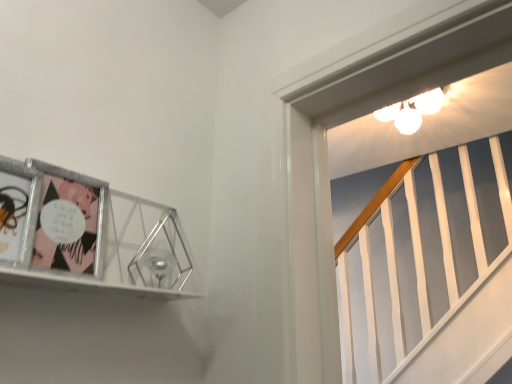
Question: Should I look upward or downward to see metallic silver picture frame at upper left?

Choices:
 (A) up
 (B) down

Answer: (B)

Question: Could you tell me if matte plastic comic book at left, marked as the 2th comic book in a front-to-back arrangement, is turned towards metallic silver picture frame at upper left?

Choices:
 (A) yes
 (B) no

Answer: (A)

Question: Is matte plastic comic book at left, the first comic book positioned from the back, oriented away from metallic silver picture frame at upper left?

Choices:
 (A) no
 (B) yes

Answer: (B)

Question: Would you say matte plastic comic book at left, marked as the 2th comic book in a front-to-back arrangement, contains metallic silver picture frame at upper left?

Choices:
 (A) no
 (B) yes

Answer: (A)

Question: Does matte plastic comic book at left, the first comic book positioned from the back, lie behind metallic silver picture frame at upper left?

Choices:
 (A) no
 (B) yes

Answer: (B)

Question: Can you confirm if matte plastic comic book at left, marked as the 2th comic book in a front-to-back arrangement, is wider than metallic silver picture frame at upper left?

Choices:
 (A) yes
 (B) no

Answer: (B)

Question: Is matte plastic comic book at left, the first comic book positioned from the back, positioned before metallic silver picture frame at upper left?

Choices:
 (A) no
 (B) yes

Answer: (A)

Question: From a real-world perspective, does metallic silver picture frame at upper left stand above matte plastic comic book at left, the first comic book positioned from the back?

Choices:
 (A) yes
 (B) no

Answer: (B)

Question: Does metallic silver picture frame at upper left come behind matte plastic comic book at left, the first comic book positioned from the back?

Choices:
 (A) yes
 (B) no

Answer: (B)

Question: Is metallic silver picture frame at upper left looking in the opposite direction of matte plastic comic book at left, the first comic book positioned from the back?

Choices:
 (A) yes
 (B) no

Answer: (A)

Question: From the image's perspective, is metallic silver picture frame at upper left on matte plastic comic book at left, marked as the 2th comic book in a front-to-back arrangement?

Choices:
 (A) no
 (B) yes

Answer: (A)

Question: Would you say metallic silver picture frame at upper left is a long distance from matte plastic comic book at left, marked as the 2th comic book in a front-to-back arrangement?

Choices:
 (A) no
 (B) yes

Answer: (A)

Question: Is metallic silver picture frame at upper left shorter than matte plastic comic book at left, the first comic book positioned from the back?

Choices:
 (A) yes
 (B) no

Answer: (B)

Question: Does metallic silver picture frame at upper left have a greater width compared to matte black comic book at left, the first comic book when ordered from front to back?

Choices:
 (A) yes
 (B) no

Answer: (A)